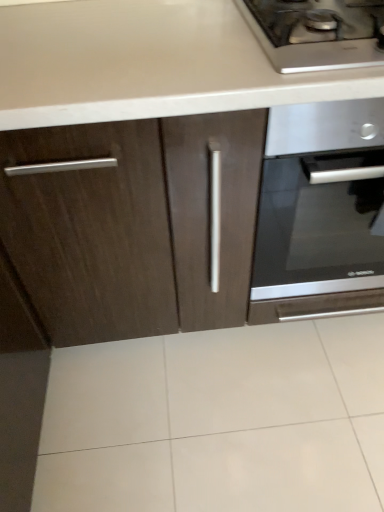
This screenshot has width=384, height=512. What are the coordinates of `satin silver oven at center-right` in the screenshot? It's located at (319, 212).

This screenshot has height=512, width=384. What do you see at coordinates (319, 212) in the screenshot? I see `satin silver oven at center-right` at bounding box center [319, 212].

Find the location of a particular element. stainless steel gas stove at upper right is located at coordinates (313, 34).

Measure the distance between point (311, 54) and camera.

A distance of 29.76 inches exists between point (311, 54) and camera.

Describe the element at coordinates (313, 34) in the screenshot. I see `stainless steel gas stove at upper right` at that location.

I want to click on satin silver oven at center-right, so click(319, 212).

Based on their positions, is satin silver oven at center-right located to the left or right of stainless steel gas stove at upper right?

From the image, it's evident that satin silver oven at center-right is to the right of stainless steel gas stove at upper right.

Who is more distant, satin silver oven at center-right or stainless steel gas stove at upper right?

satin silver oven at center-right is further from the camera.

Is point (348, 129) in front of point (286, 8)?

Yes, it is in front of point (286, 8).

From the image's perspective, is satin silver oven at center-right located above or below stainless steel gas stove at upper right?

Based on their image positions, satin silver oven at center-right is located beneath stainless steel gas stove at upper right.

From a real-world perspective, is satin silver oven at center-right physically located above or below stainless steel gas stove at upper right?

In terms of real-world spatial position, satin silver oven at center-right is below stainless steel gas stove at upper right.

Between satin silver oven at center-right and stainless steel gas stove at upper right, which one has larger width?

satin silver oven at center-right is wider.

Which of these two, satin silver oven at center-right or stainless steel gas stove at upper right, stands taller?

satin silver oven at center-right is taller.

Can you confirm if satin silver oven at center-right is smaller than stainless steel gas stove at upper right?

Incorrect, satin silver oven at center-right is not smaller in size than stainless steel gas stove at upper right.

Based on the photo, is satin silver oven at center-right positioned beyond the bounds of stainless steel gas stove at upper right?

Absolutely, satin silver oven at center-right is external to stainless steel gas stove at upper right.

Would you say satin silver oven at center-right is a long distance from stainless steel gas stove at upper right?

satin silver oven at center-right is near stainless steel gas stove at upper right, not far away.

Does satin silver oven at center-right turn towards stainless steel gas stove at upper right?

No.

Can you tell me how much satin silver oven at center-right and stainless steel gas stove at upper right differ in facing direction?

They differ by 1.05 degrees in their facing directions.

What are the coordinates of `oven on the right of stainless steel gas stove at upper right` in the screenshot? It's located at (319, 212).

Can you confirm if stainless steel gas stove at upper right is positioned to the right of satin silver oven at center-right?

No, stainless steel gas stove at upper right is not to the right of satin silver oven at center-right.

Looking at this image, is stainless steel gas stove at upper right positioned before satin silver oven at center-right?

Answer: Yes, it is.

Considering the points (319, 1) and (306, 250), which point is in front, point (319, 1) or point (306, 250)?

The point (319, 1) is closer.

From the image's perspective, is stainless steel gas stove at upper right above or below satin silver oven at center-right?

Clearly, from the image's perspective, stainless steel gas stove at upper right is above satin silver oven at center-right.

From a real-world perspective, who is located lower, stainless steel gas stove at upper right or satin silver oven at center-right?

In real-world perspective, satin silver oven at center-right is lower.

Between stainless steel gas stove at upper right and satin silver oven at center-right, which one has smaller width?

With smaller width is stainless steel gas stove at upper right.

Can you confirm if stainless steel gas stove at upper right is shorter than satin silver oven at center-right?

Indeed, stainless steel gas stove at upper right has a lesser height compared to satin silver oven at center-right.

Between stainless steel gas stove at upper right and satin silver oven at center-right, which one has larger size?

satin silver oven at center-right.

From the picture: Which is correct: stainless steel gas stove at upper right is inside satin silver oven at center-right, or outside of it?

stainless steel gas stove at upper right is located beyond the bounds of satin silver oven at center-right.

Is stainless steel gas stove at upper right far from satin silver oven at center-right?

They are positioned close to each other.

Based on the photo, is stainless steel gas stove at upper right positioned with its back to satin silver oven at center-right?

No, satin silver oven at center-right is not at the back of stainless steel gas stove at upper right.

Locate an element on the screen. The width and height of the screenshot is (384, 512). gas stove located above the satin silver oven at center-right (from a real-world perspective) is located at coordinates (313, 34).

Image resolution: width=384 pixels, height=512 pixels. I want to click on gas stove located in front of the satin silver oven at center-right, so click(313, 34).

In the image, there is a satin silver oven at center-right. Identify the location of gas stove above it (from the image's perspective). The image size is (384, 512). coord(313,34).